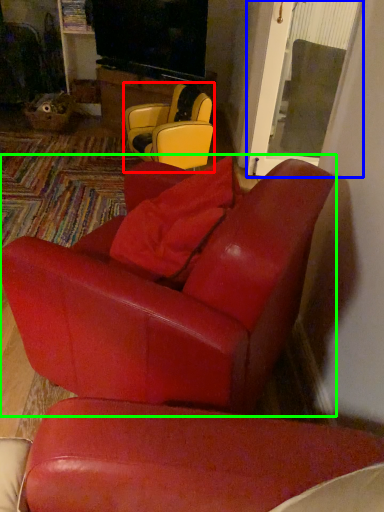
Question: Based on their relative distances, which object is farther from chair (highlighted by a red box)? Choose from glass door (highlighted by a blue box) and chair (highlighted by a green box).

Choices:
 (A) glass door
 (B) chair

Answer: (B)